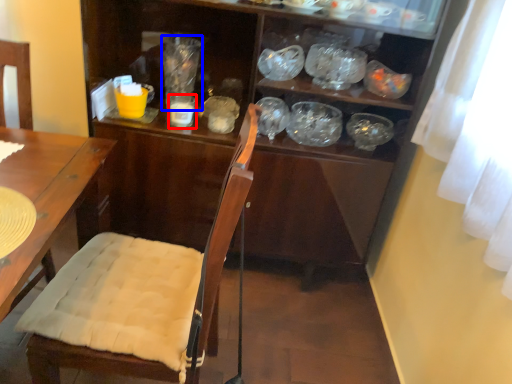
Question: Which object appears closest to the camera in this image, tableware (highlighted by a red box) or glass jar (highlighted by a blue box)?

Choices:
 (A) tableware
 (B) glass jar

Answer: (A)